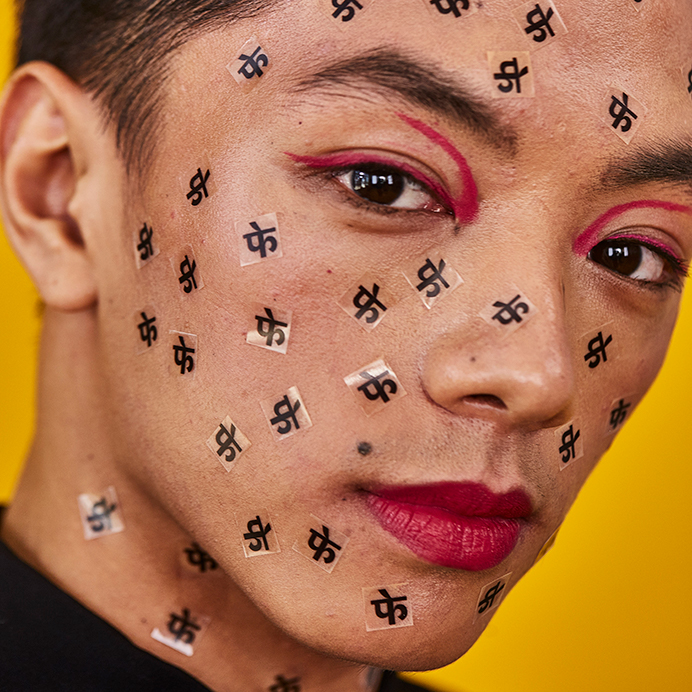
Locate an element on the screen. sticker is located at coordinates (181, 625).